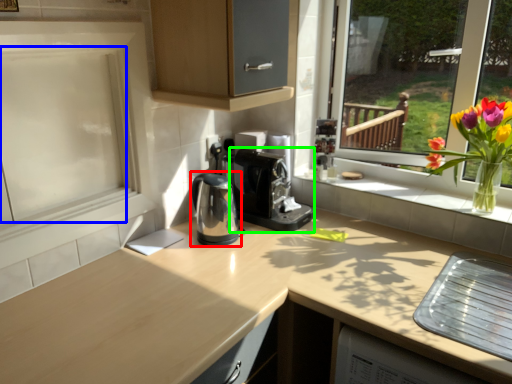
Question: Considering the real-world distances, which object is closest to coffeepot (highlighted by a red box)? screen door (highlighted by a blue box) or coffee machine (highlighted by a green box).

Choices:
 (A) screen door
 (B) coffee machine

Answer: (B)